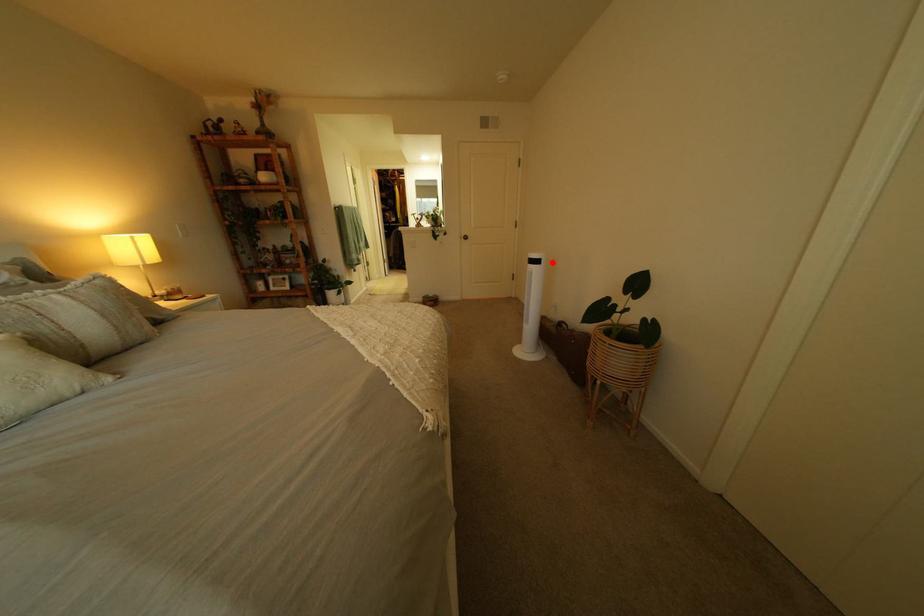
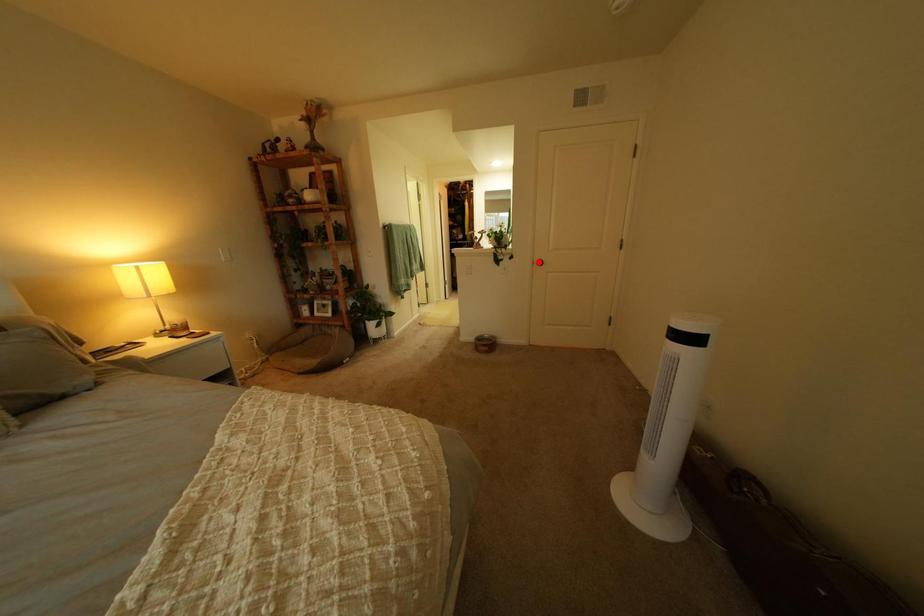
I am providing you with two images of the same scene from different viewpoints. A red point is marked on the first image and another point is marked on the second image. Are the points marked in image1 and image2 representing the same 3D position?

No